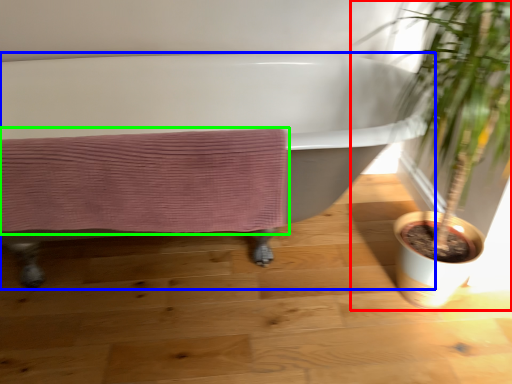
Question: Which is nearer to the houseplant (highlighted by a red box)? bathtub (highlighted by a blue box) or bath towel (highlighted by a green box).

Choices:
 (A) bathtub
 (B) bath towel

Answer: (B)